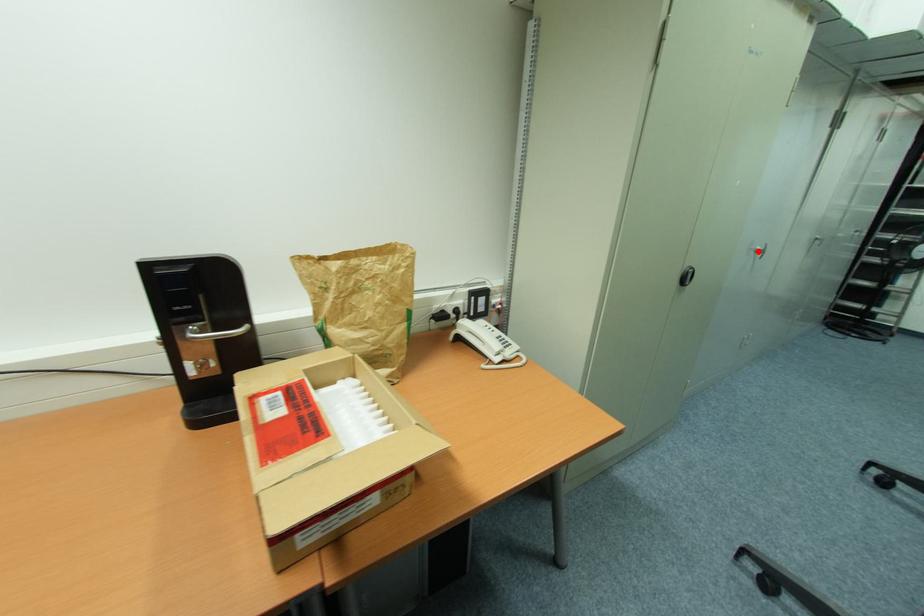
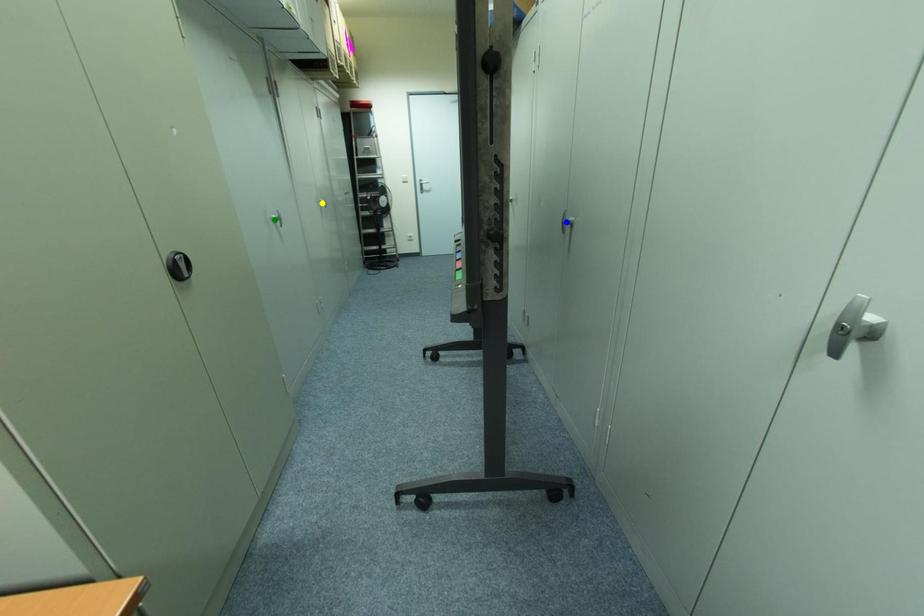
Question: I am providing you with two images of the same scene from different viewpoints. A red point is marked on the first image. You are given multiple points on the second image. Which spot in image 2 lines up with the point in image 1?

Choices:
 (A) yellow point
 (B) green point
 (C) blue point

Answer: (B)